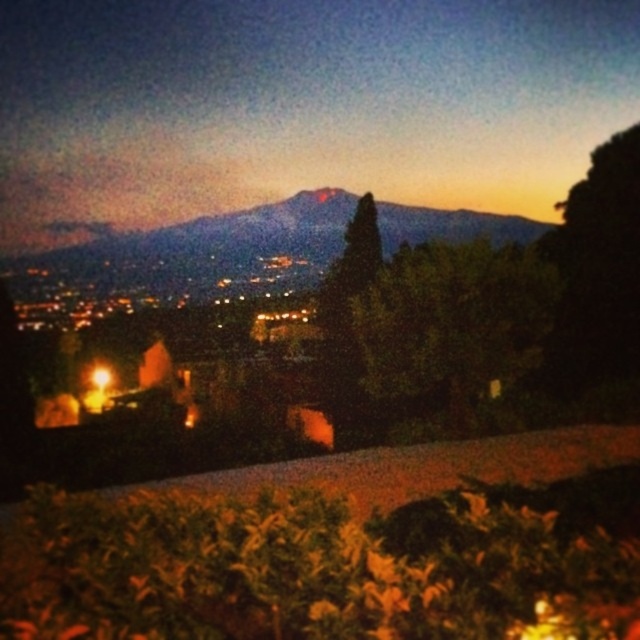
Question: Does matte black mountain at upper center come behind blue-gray mountain at center?

Choices:
 (A) yes
 (B) no

Answer: (A)

Question: Can you confirm if matte black mountain at upper center is bigger than blue-gray mountain at center?

Choices:
 (A) yes
 (B) no

Answer: (A)

Question: Which object is closer to the camera taking this photo?

Choices:
 (A) blue-gray mountain at center
 (B) matte black mountain at upper center

Answer: (A)

Question: In this image, where is matte black mountain at upper center located relative to blue-gray mountain at center?

Choices:
 (A) left
 (B) right

Answer: (B)

Question: Which object is closer to the camera taking this photo?

Choices:
 (A) blue-gray mountain at center
 (B) matte black mountain at upper center

Answer: (A)

Question: Among these points, which one is nearest to the camera?

Choices:
 (A) (x=44, y=145)
 (B) (x=244, y=227)

Answer: (B)